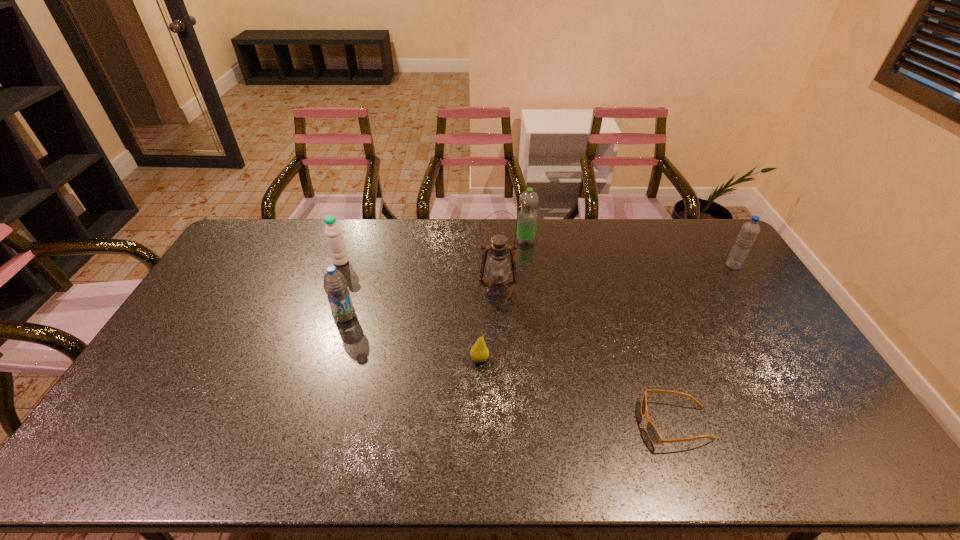
You are a GUI agent. You are given a task and a screenshot of the screen. Output one action in this format:
    pyautogui.click(x=<x>, y=<y>)
    Task: Click on the vacant space that is in between the sixth object from left to right and the fourth farthest object
    The width and height of the screenshot is (960, 540).
    Given the screenshot: What is the action you would take?
    pyautogui.click(x=587, y=359)

Image resolution: width=960 pixels, height=540 pixels. I want to click on vacant point located between the nearest water bottle and the rightmost object, so click(539, 291).

You are a GUI agent. You are given a task and a screenshot of the screen. Output one action in this format:
    pyautogui.click(x=<x>, y=<y>)
    Task: Click on the unoccupied area between the rightmost water bottle and the pear
    This screenshot has width=960, height=540.
    Given the screenshot: What is the action you would take?
    pyautogui.click(x=607, y=313)

The height and width of the screenshot is (540, 960). In order to click on free area in between the shortest object and the tallest object in this screenshot , I will do `click(587, 359)`.

Identify the location of blank region between the tallest object and the sunglasses. [587, 359].

Where is `vacant area that lies between the farthest object and the second object from left to right`? This screenshot has width=960, height=540. vacant area that lies between the farthest object and the second object from left to right is located at coordinates (435, 279).

Locate which object is the closest to the farthest object. Please provide its 2D coordinates. Your answer should be formatted as a tuple, i.e. [(x, y)], where the tuple contains the x and y coordinates of a point satisfying the conditions above.

[(497, 289)]

Identify which object is located as the sixth nearest to the rightmost water bottle. Please provide its 2D coordinates. Your answer should be formatted as a tuple, i.e. [(x, y)], where the tuple contains the x and y coordinates of a point satisfying the conditions above.

[(333, 233)]

Select which water bottle is the third closest to the second shortest object. Please provide its 2D coordinates. Your answer should be formatted as a tuple, i.e. [(x, y)], where the tuple contains the x and y coordinates of a point satisfying the conditions above.

[(333, 233)]

The width and height of the screenshot is (960, 540). Find the location of `water bottle that is the third closest to the rightmost object`. water bottle that is the third closest to the rightmost object is located at coordinates (333, 233).